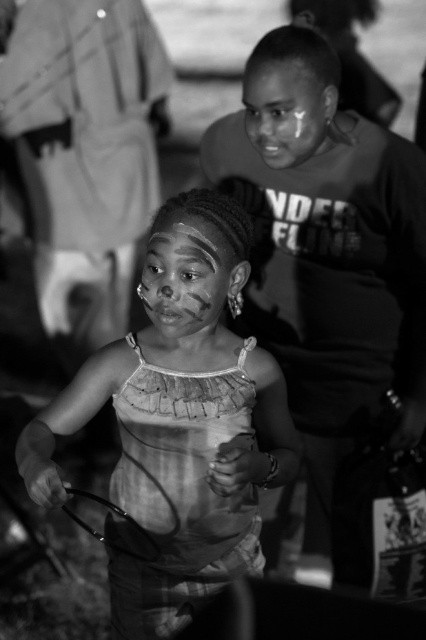
Does matte painted face at center have a lesser height compared to matte skin face at upper center?

Incorrect, matte painted face at center's height does not fall short of matte skin face at upper center's.

In order to click on matte painted face at center in this screenshot , I will do `click(184, 278)`.

Does smooth skin boy at center appear on the right side of matte fabric dress at center?

Correct, you'll find smooth skin boy at center to the right of matte fabric dress at center.

Which is above, smooth skin boy at center or matte fabric dress at center?

smooth skin boy at center is higher up.

Which is in front, point (227, 140) or point (253, 538)?

Positioned in front is point (253, 538).

At what (x,y) coordinates should I click in order to perform the action: click on smooth skin boy at center. Please return your answer as a coordinate pair (x, y). The width and height of the screenshot is (426, 640). Looking at the image, I should click on (327, 253).

Does point (216, 241) come closer to viewer compared to point (250, 108)?

Yes, point (216, 241) is closer to viewer.

Does matte fabric dress at center have a larger size compared to matte skin face at upper center?

Yes, matte fabric dress at center is bigger than matte skin face at upper center.

This screenshot has height=640, width=426. What do you see at coordinates (178, 424) in the screenshot?
I see `matte fabric dress at center` at bounding box center [178, 424].

Image resolution: width=426 pixels, height=640 pixels. Identify the location of matte fabric dress at center. (178, 424).